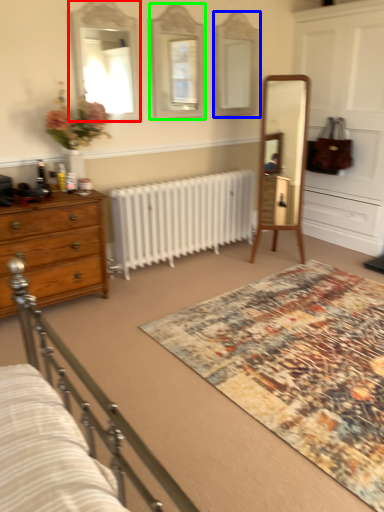
Question: Based on their relative distances, which object is farther from mirror (highlighted by a red box)? Choose from mirror (highlighted by a blue box) and mirror (highlighted by a green box).

Choices:
 (A) mirror
 (B) mirror

Answer: (A)